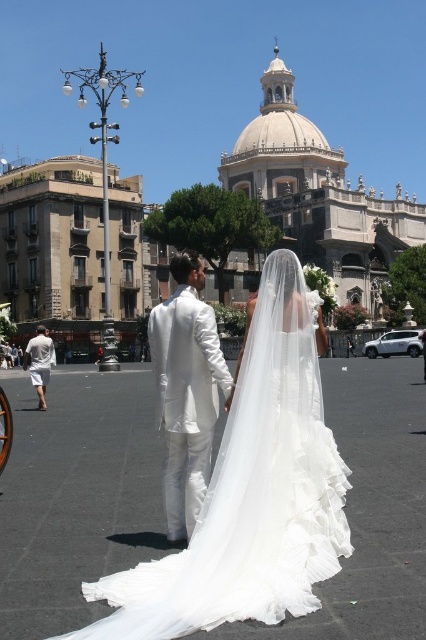
Question: Which of these objects is positioned closest to the matte white gown at center?

Choices:
 (A) white satin suit at center
 (B) white cotton shorts at lower left

Answer: (A)

Question: Is matte white gown at center closer to camera compared to white satin suit at center?

Choices:
 (A) yes
 (B) no

Answer: (A)

Question: Does matte white gown at center appear on the right side of white cotton shorts at lower left?

Choices:
 (A) yes
 (B) no

Answer: (A)

Question: Does matte white gown at center have a larger size compared to white cotton shorts at lower left?

Choices:
 (A) no
 (B) yes

Answer: (B)

Question: Which point appears farthest from the camera in this image?

Choices:
 (A) (204, 461)
 (B) (112, 625)

Answer: (A)

Question: Which object appears farthest from the camera in this image?

Choices:
 (A) white cotton shorts at lower left
 (B) white satin suit at center

Answer: (A)